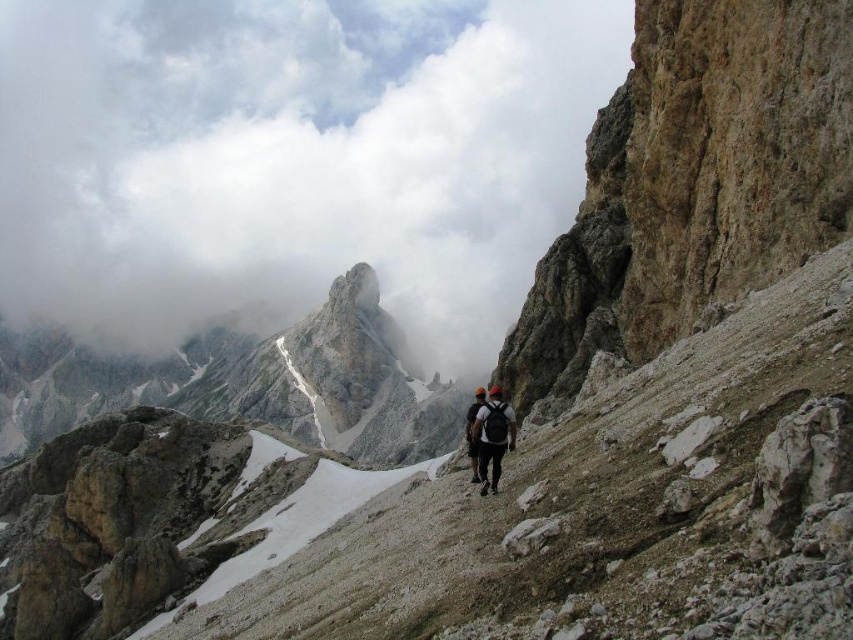
Question: Does white fluffy cloud at upper center lie in front of black fabric backpack at center?

Choices:
 (A) no
 (B) yes

Answer: (A)

Question: Is white fluffy cloud at upper center wider than dark gray backpack at center?

Choices:
 (A) no
 (B) yes

Answer: (B)

Question: Which is farther from the white fluffy cloud at upper center?

Choices:
 (A) black fabric backpack at center
 (B) dark gray backpack at center

Answer: (B)

Question: Which point appears farthest from the camera in this image?

Choices:
 (A) (500, 54)
 (B) (469, 412)
 (C) (491, 433)

Answer: (A)

Question: Based on their relative distances, which object is nearer to the black fabric backpack at center?

Choices:
 (A) white fluffy cloud at upper center
 (B) dark gray backpack at center

Answer: (B)

Question: Can you confirm if dark gray backpack at center is bigger than black fabric backpack at center?

Choices:
 (A) no
 (B) yes

Answer: (A)